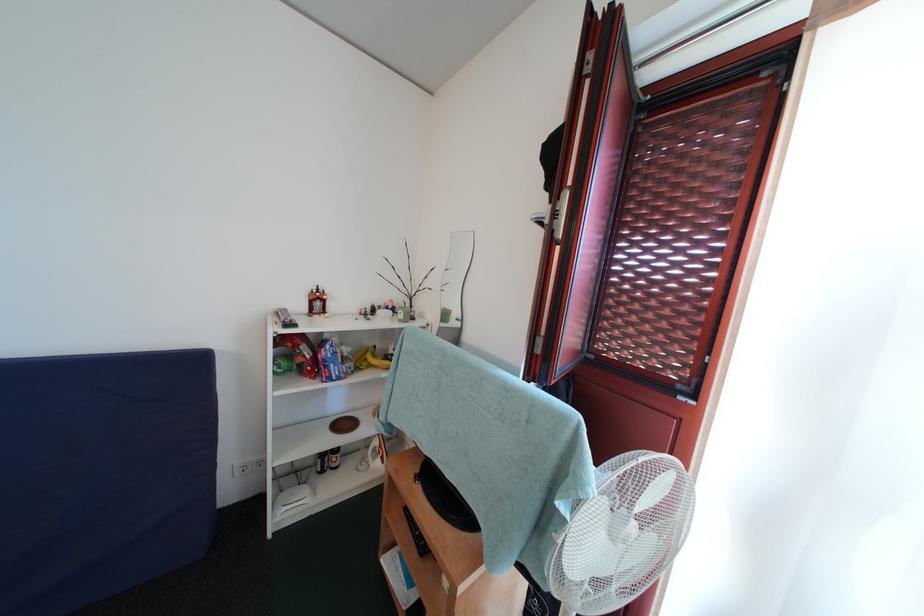
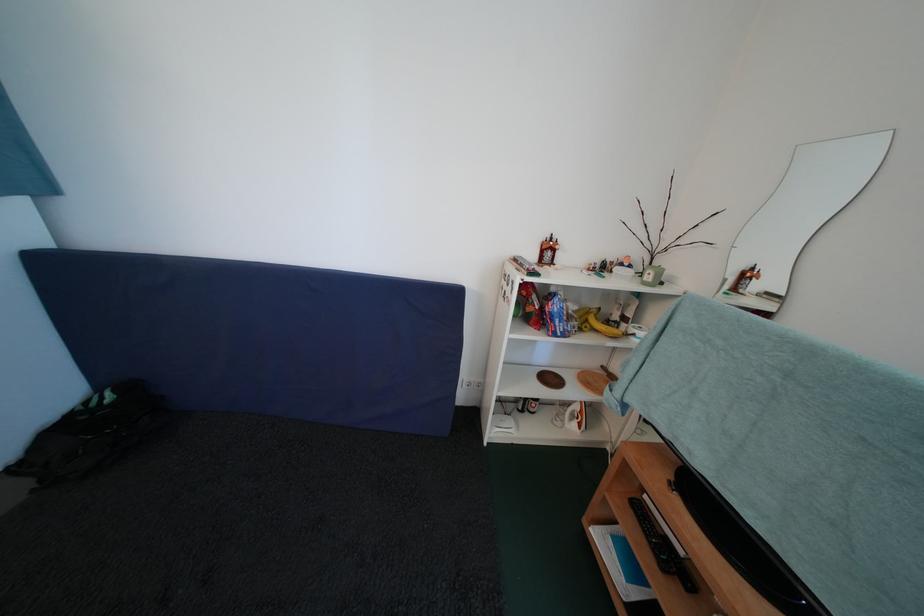
Locate, in the second image, the point that corresponds to (x=339, y=371) in the first image.

(565, 326)